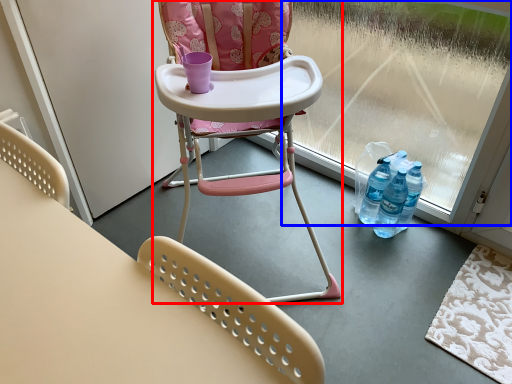
Question: Which point is further to the camera, chair (highlighted by a red box) or window screen (highlighted by a blue box)?

Choices:
 (A) chair
 (B) window screen

Answer: (B)